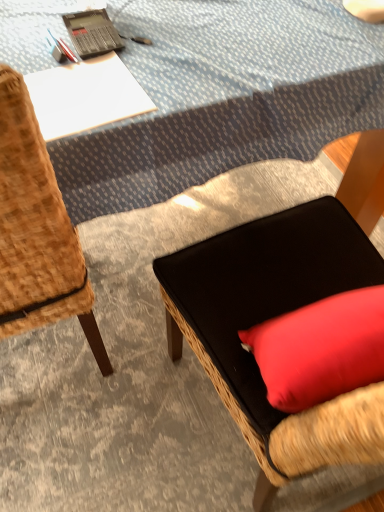
Question: Is black plastic calculator at upper left thinner than woven wood chair at left, which is counted as the second chair, starting from the right?

Choices:
 (A) yes
 (B) no

Answer: (A)

Question: Can you confirm if black plastic calculator at upper left is bigger than woven wood chair at left, which is counted as the second chair, starting from the right?

Choices:
 (A) no
 (B) yes

Answer: (A)

Question: Considering the relative sizes of black plastic calculator at upper left and woven wood chair at left, which appears as the 1th chair when viewed from the left, in the image provided, is black plastic calculator at upper left wider than woven wood chair at left, which appears as the 1th chair when viewed from the left,?

Choices:
 (A) no
 (B) yes

Answer: (A)

Question: Does black plastic calculator at upper left have a lesser height compared to woven wood chair at left, which appears as the 1th chair when viewed from the left?

Choices:
 (A) no
 (B) yes

Answer: (B)

Question: Can you confirm if black plastic calculator at upper left is positioned to the right of woven wood chair at left, which is counted as the second chair, starting from the right?

Choices:
 (A) yes
 (B) no

Answer: (A)

Question: Is black plastic calculator at upper left with woven wood chair at left, which appears as the 1th chair when viewed from the left?

Choices:
 (A) yes
 (B) no

Answer: (B)

Question: Considering the relative sizes of black fabric cushion at center, which is the second chair in left-to-right order, and black plastic calculator at upper left in the image provided, is black fabric cushion at center, which is the second chair in left-to-right order, taller than black plastic calculator at upper left?

Choices:
 (A) no
 (B) yes

Answer: (B)

Question: From the image's perspective, is black fabric cushion at center, which is the second chair in left-to-right order, beneath black plastic calculator at upper left?

Choices:
 (A) no
 (B) yes

Answer: (B)

Question: Is black fabric cushion at center, which is the second chair in left-to-right order, positioned before black plastic calculator at upper left?

Choices:
 (A) yes
 (B) no

Answer: (A)

Question: Is black fabric cushion at center, which is the second chair in left-to-right order, facing away from black plastic calculator at upper left?

Choices:
 (A) yes
 (B) no

Answer: (B)

Question: Does black fabric cushion at center, which is the second chair in left-to-right order, lie behind black plastic calculator at upper left?

Choices:
 (A) no
 (B) yes

Answer: (A)

Question: From a real-world perspective, is black fabric cushion at center, the 1th chair from the right, on top of black plastic calculator at upper left?

Choices:
 (A) no
 (B) yes

Answer: (A)

Question: Can you confirm if woven wood chair at left, which is counted as the second chair, starting from the right, is positioned to the right of blue textured tablecloth at upper center?

Choices:
 (A) yes
 (B) no

Answer: (B)